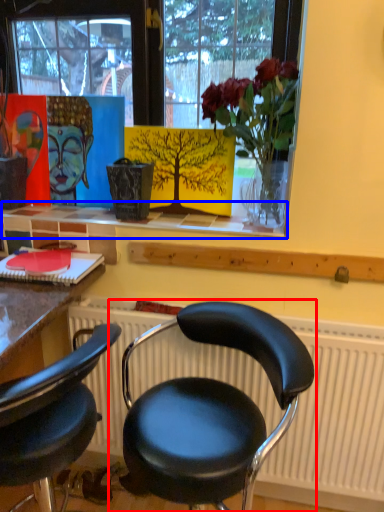
Question: Which of the following is the closest to the observer, chair (highlighted by a red box) or window sill (highlighted by a blue box)?

Choices:
 (A) chair
 (B) window sill

Answer: (A)